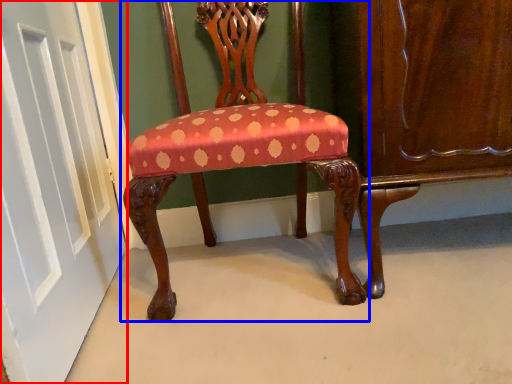
Question: Which point is closer to the camera, door (highlighted by a red box) or chair (highlighted by a blue box)?

Choices:
 (A) door
 (B) chair

Answer: (A)